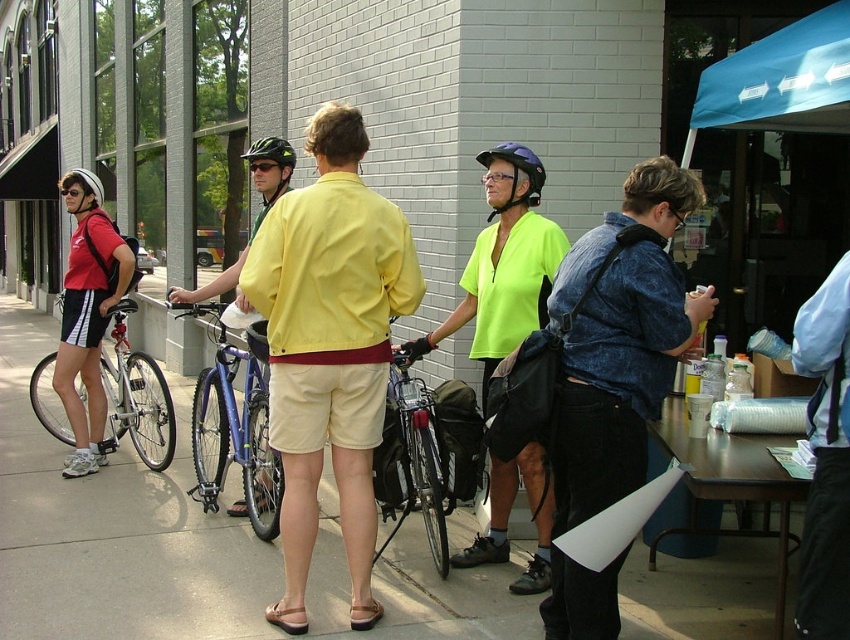
Question: Which of these objects is positioned farthest from the yellow fabric shirt at center?

Choices:
 (A) matte black backpack at left
 (B) shiny black bicycle at center
 (C) denim shirt at center
 (D) purple matte helmet at center

Answer: (A)

Question: Is shiny blue bicycle at center below matte black backpack at left?

Choices:
 (A) no
 (B) yes

Answer: (B)

Question: Considering the relative positions of yellow fabric shirt at center and shiny black bicycle at center in the image provided, where is yellow fabric shirt at center located with respect to shiny black bicycle at center?

Choices:
 (A) left
 (B) right

Answer: (A)

Question: Which point is closer to the camera?

Choices:
 (A) yellow fabric shirt at center
 (B) denim shirt at center
 (C) neon yellow jersey at center
 (D) matte black backpack at left

Answer: (B)

Question: Is silver metallic bicycle at left further to camera compared to purple matte helmet at center?

Choices:
 (A) yes
 (B) no

Answer: (A)

Question: Which point appears farthest from the camera in this image?

Choices:
 (A) (646, 636)
 (B) (571, 356)

Answer: (A)